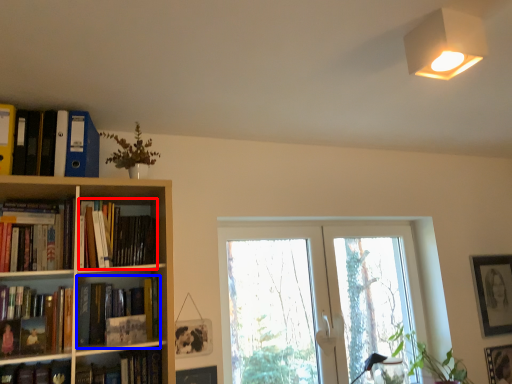
Question: Which object appears closest to the camera in this image, book (highlighted by a red box) or book (highlighted by a blue box)?

Choices:
 (A) book
 (B) book

Answer: (A)